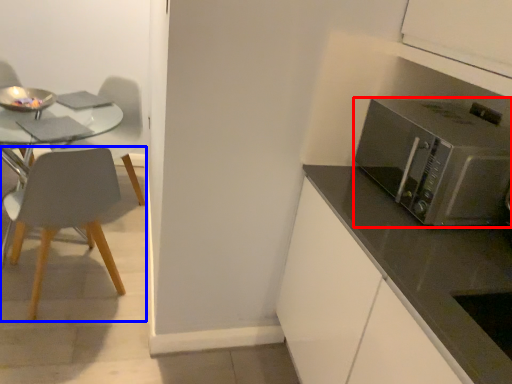
Question: Among these objects, which one is farthest to the camera, microwave oven (highlighted by a red box) or chair (highlighted by a blue box)?

Choices:
 (A) microwave oven
 (B) chair

Answer: (B)